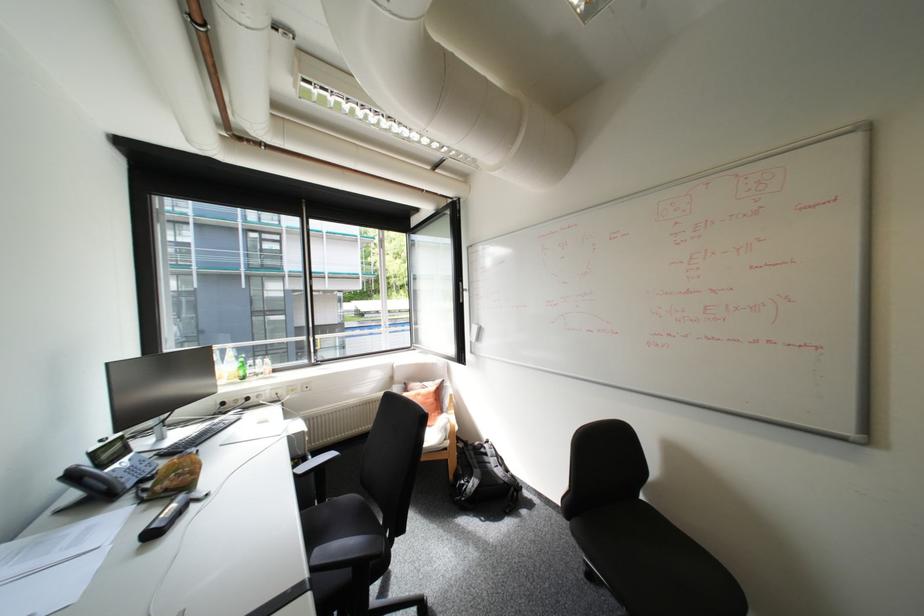
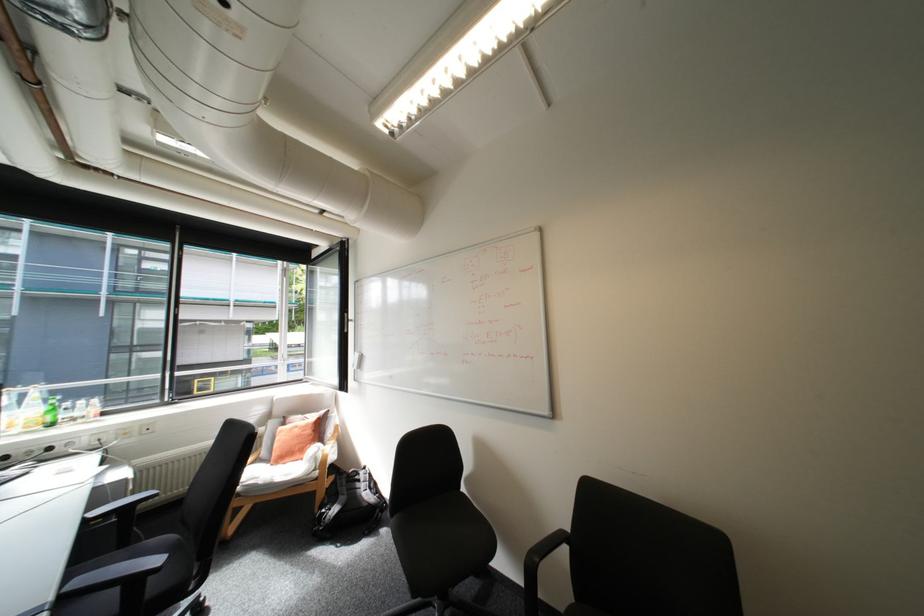
In the second image, find the point that corresponds to point 305,475 in the first image.

(94, 519)